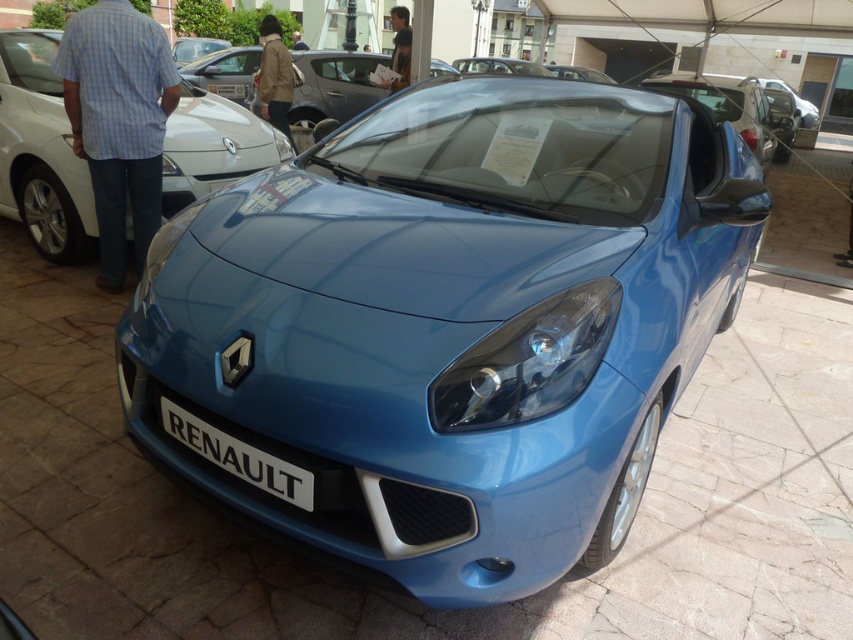
You are standing in front of the Renault car and want to take a photo. You notice two points on the car, one at point [285,438] and another at point [15,77]. Which point is closer to your camera when taking the photo?

Point [285,438] is closer to the camera than point [15,77].

You are standing in front of the Renault car and want to pick up the light brown leather jacket at upper center. Can you reach it without moving the white plastic license plate at center?

The light brown leather jacket at upper center is farther away from you than the white plastic license plate at center. Since the license plate is closer, you would need to move it to reach the jacket.

You are a photographer taking a closeup shot of the white matte license plate at center. There is a blue cotton shirt at left in the frame. Which object is positioned more to the left side of the photo?

The blue cotton shirt at left is positioned more to the left side of the photo than the white matte license plate at center.